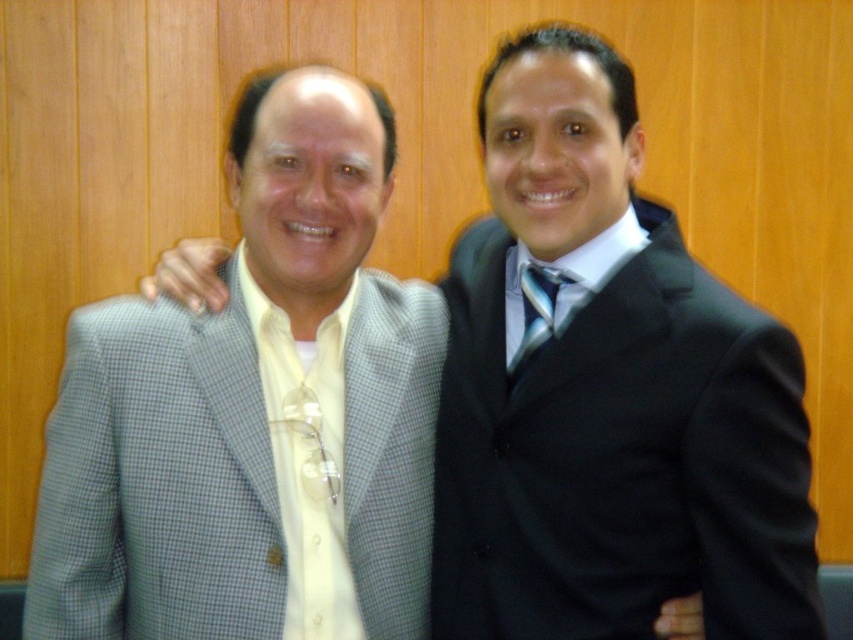
You are a photographer adjusting the camera focus. You need to ensure both the gray checkered suit at left and the shiny blue tie at center are in focus. Which object should you adjust the focus on first to ensure both are sharp?

The gray checkered suit at left is larger in size compared to the shiny blue tie at center, so you should focus on the gray checkered suit at left first to ensure both are in focus.

You are standing in front of the two men in the image. You want to place a small decoration exactly halfway between the point at (770, 372) and the point at (546, 308). Will the decoration be closer to the man on the left or the man on the right?

The decoration placed halfway between point (770, 372) and point (546, 308) will be closer to the man on the right because point (770, 372) is closer to the viewer than point (546, 308).

You are a photographer adjusting your camera settings to focus on the gray checkered suit at left and the shiny blue tie at center. Since you want to ensure both are in focus, which object should you focus on first to achieve proper depth of field?

The gray checkered suit at left is in front of the shiny blue tie at center. To ensure both are in focus, you should focus on the shiny blue tie at center first, as it is further away, allowing the depth of field to cover both objects.